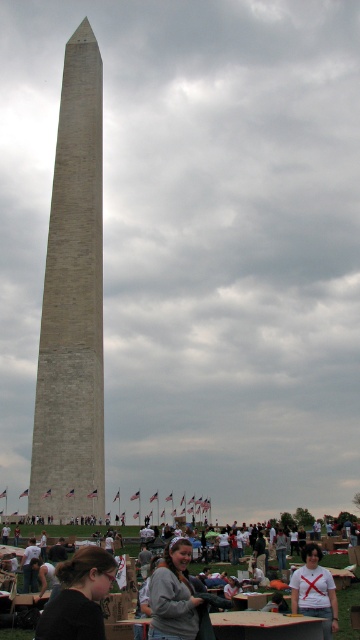
Question: Is the position of beige stone tower at center more distant than that of dark brown hair at lower left?

Choices:
 (A) yes
 (B) no

Answer: (A)

Question: Estimate the real-world distances between objects in this image. Which object is closer to the beige stone tower at center?

Choices:
 (A) dark brown hair at lower left
 (B) white matte shirt at lower center
 (C) gray fabric jacket at lower center
 (D) gray sweatshirt at lower center

Answer: (C)

Question: Which is farther from the gray fabric jacket at lower center?

Choices:
 (A) gray sweatshirt at lower center
 (B) white matte shirt at lower center

Answer: (B)

Question: Is beige stone tower at center thinner than gray fabric jacket at lower center?

Choices:
 (A) yes
 (B) no

Answer: (A)

Question: Among these objects, which one is nearest to the camera?

Choices:
 (A) gray sweatshirt at lower center
 (B) gray fabric jacket at lower center
 (C) beige stone tower at center
 (D) white matte shirt at lower center

Answer: (A)

Question: Can you confirm if beige stone tower at center is positioned to the right of gray sweatshirt at lower center?

Choices:
 (A) no
 (B) yes

Answer: (A)